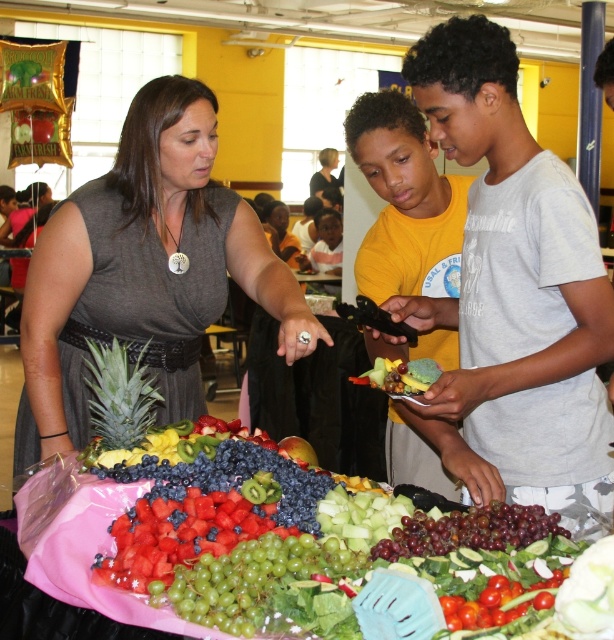
Is red matte watermelon at center taller than green textured pineapple at left?

No.

Does red matte watermelon at center appear on the left side of green textured pineapple at left?

In fact, red matte watermelon at center is to the right of green textured pineapple at left.

Identify the location of red matte watermelon at center. (176, 536).

Does matte gray dress at center appear on the left side of shiny yellow banana at center?

Indeed, matte gray dress at center is positioned on the left side of shiny yellow banana at center.

Between point (254, 291) and point (426, 371), which one is positioned behind?

Positioned behind is point (254, 291).

At what (x,y) coordinates should I click in order to perform the action: click on matte gray dress at center. Please return your answer as a coordinate pair (x, y). Image resolution: width=614 pixels, height=640 pixels. Looking at the image, I should click on (144, 272).

This screenshot has height=640, width=614. I want to click on matte gray dress at center, so click(x=144, y=272).

Can you confirm if matte gray dress at center is wider than shiny red apple at center?

Correct, the width of matte gray dress at center exceeds that of shiny red apple at center.

Image resolution: width=614 pixels, height=640 pixels. In order to click on matte gray dress at center in this screenshot , I will do `click(144, 272)`.

In order to click on matte gray dress at center in this screenshot , I will do (x=144, y=272).